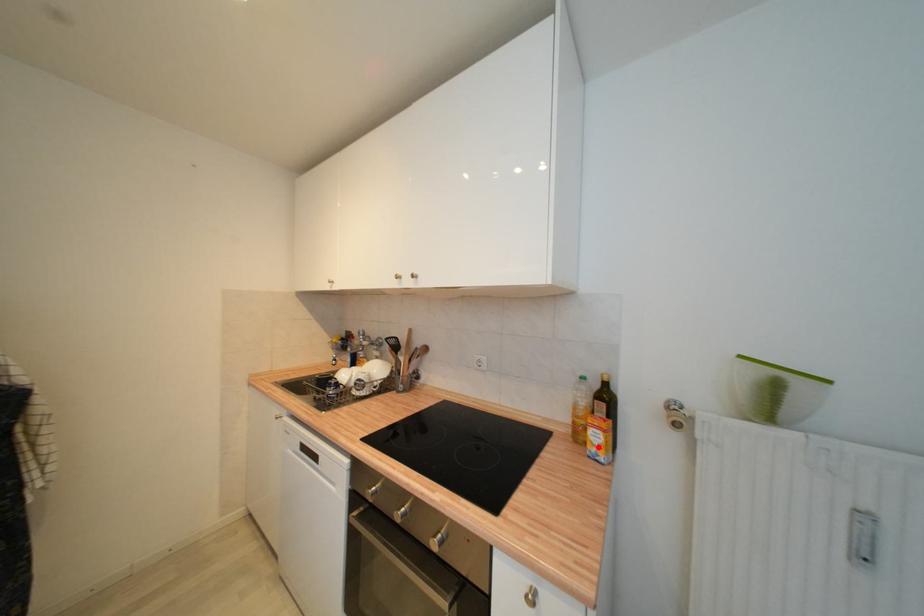
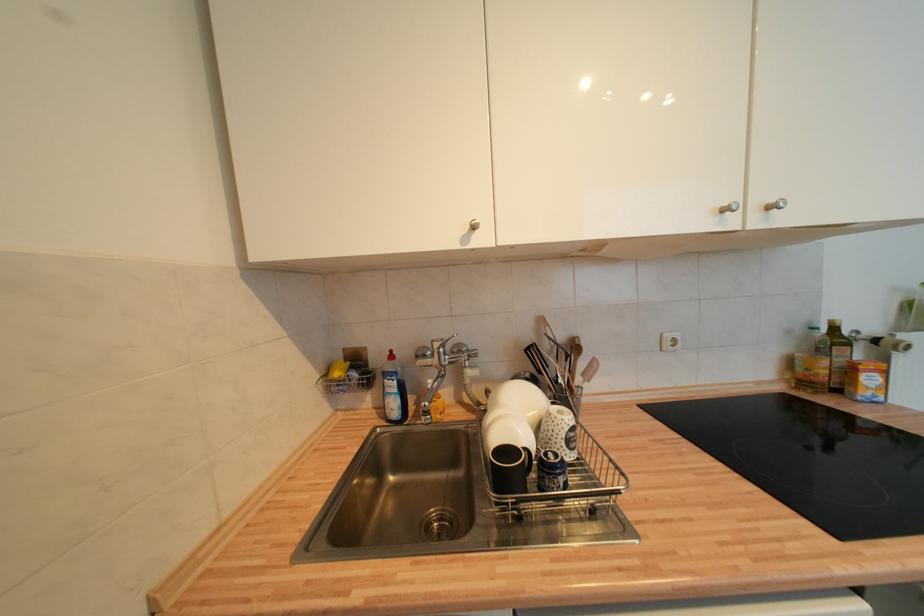
In the second image, find the point that corresponds to the highlighted location in the first image.

(873, 391)